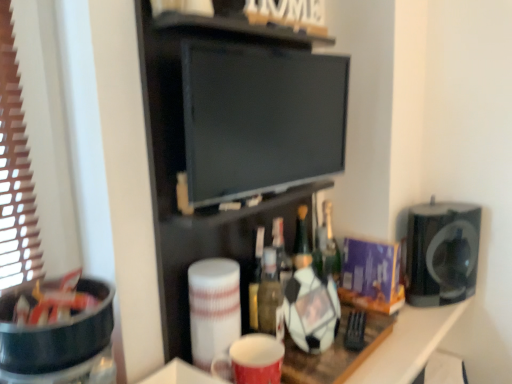
Question: Considering the relative positions of translucent glass bottle at center and black matte speaker at right, placed as the first appliance when sorted from back to front, in the image provided, is translucent glass bottle at center behind black matte speaker at right, placed as the first appliance when sorted from back to front,?

Choices:
 (A) no
 (B) yes

Answer: (B)

Question: Would you consider translucent glass bottle at center to be distant from black matte speaker at right, the first appliance when ordered from right to left?

Choices:
 (A) no
 (B) yes

Answer: (A)

Question: Can you confirm if translucent glass bottle at center is taller than black matte speaker at right, acting as the 2th appliance starting from the front?

Choices:
 (A) yes
 (B) no

Answer: (B)

Question: Can you confirm if translucent glass bottle at center is bigger than black matte speaker at right, the 2th appliance positioned from the left?

Choices:
 (A) no
 (B) yes

Answer: (A)

Question: Considering the relative sizes of translucent glass bottle at center and black matte speaker at right, acting as the 2th appliance starting from the front, in the image provided, is translucent glass bottle at center shorter than black matte speaker at right, acting as the 2th appliance starting from the front,?

Choices:
 (A) yes
 (B) no

Answer: (A)

Question: In terms of height, does black matte speaker at right, placed as the first appliance when sorted from back to front, look taller or shorter compared to black plastic bowl at left, arranged as the 1th appliance when viewed from the left?

Choices:
 (A) tall
 (B) short

Answer: (A)

Question: In the image, is black matte speaker at right, the first appliance when ordered from right to left, positioned in front of or behind black plastic bowl at left, arranged as the 1th appliance when viewed from the left?

Choices:
 (A) front
 (B) behind

Answer: (B)

Question: In terms of size, does black matte speaker at right, acting as the 2th appliance starting from the front, appear bigger or smaller than black plastic bowl at left, the second appliance in the back-to-front sequence?

Choices:
 (A) big
 (B) small

Answer: (A)

Question: Is black matte speaker at right, acting as the 2th appliance starting from the front, to the left or to the right of black plastic bowl at left, arranged as the 1th appliance when viewed from the left, in the image?

Choices:
 (A) left
 (B) right

Answer: (B)

Question: From the image's perspective, is translucent glass bottle at center positioned above or below black glossy flat screen tv at center?

Choices:
 (A) below
 (B) above

Answer: (A)

Question: Looking at the image, does translucent glass bottle at center seem bigger or smaller compared to black glossy flat screen tv at center?

Choices:
 (A) small
 (B) big

Answer: (A)

Question: Considering the positions of translucent glass bottle at center and black glossy flat screen tv at center in the image, is translucent glass bottle at center wider or thinner than black glossy flat screen tv at center?

Choices:
 (A) thin
 (B) wide

Answer: (B)

Question: Is translucent glass bottle at center taller or shorter than black glossy flat screen tv at center?

Choices:
 (A) tall
 (B) short

Answer: (B)

Question: From the image's perspective, is translucent glass bottle at center above or below black matte speaker at right, the first appliance when ordered from right to left?

Choices:
 (A) above
 (B) below

Answer: (A)

Question: In terms of size, does translucent glass bottle at center appear bigger or smaller than black matte speaker at right, the first appliance when ordered from right to left?

Choices:
 (A) big
 (B) small

Answer: (B)